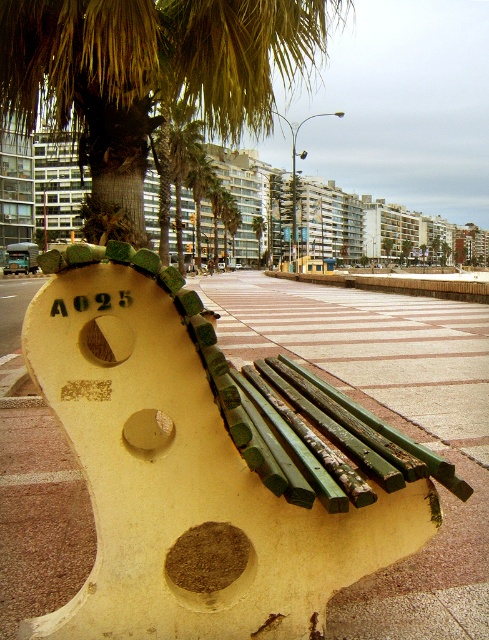
Question: Is green leafy palm tree at upper center above green leafy palm tree at center?

Choices:
 (A) yes
 (B) no

Answer: (A)

Question: Estimate the real-world distances between objects in this image. Which object is farther from the brown dirt at center?

Choices:
 (A) green leafy palm tree at upper center
 (B) smooth concrete bench at center

Answer: (B)

Question: Does green leafy palm tree at upper center have a greater width compared to green painted wood bench at lower center?

Choices:
 (A) yes
 (B) no

Answer: (A)

Question: Based on their relative distances, which object is nearer to the green painted wood bench at lower center?

Choices:
 (A) green leafy palm tree at center
 (B) smooth concrete bench at center
 (C) brown dirt at center
 (D) green leafy palm tree at upper center

Answer: (C)

Question: Is smooth concrete bench at center positioned before green leafy palm tree at upper center?

Choices:
 (A) no
 (B) yes

Answer: (B)

Question: Which point appears closest to the camera in this image?

Choices:
 (A) (203, 154)
 (B) (464, 305)
 (C) (231, 369)
 (D) (218, 28)

Answer: (C)